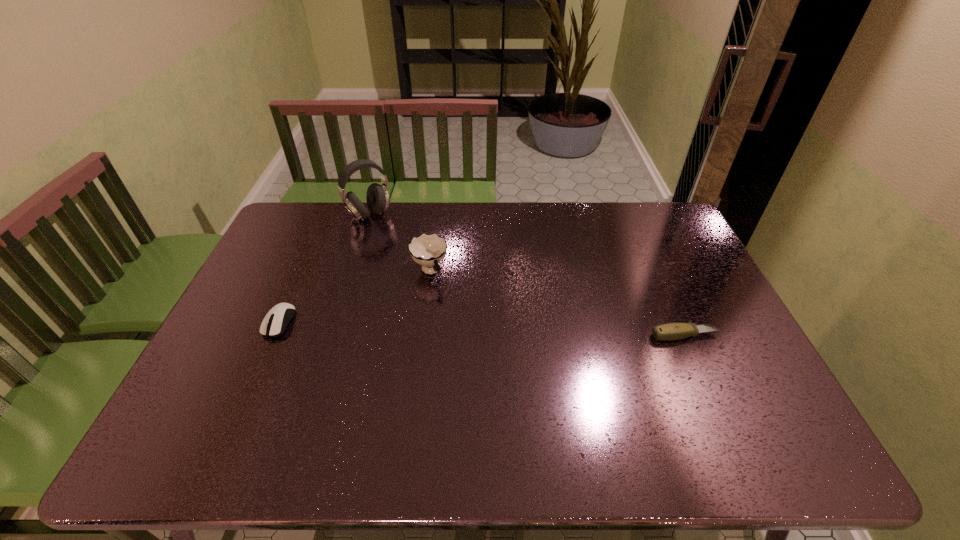
Find the location of `the second shortest object`. the second shortest object is located at coordinates (272, 325).

At what (x,y) coordinates should I click in order to perform the action: click on the leftmost object. Please return your answer as a coordinate pair (x, y). This screenshot has width=960, height=540. Looking at the image, I should click on (272, 325).

I want to click on the rightmost object, so click(x=671, y=331).

This screenshot has height=540, width=960. I want to click on the shortest object, so click(x=671, y=331).

Where is `the tallest object`? the tallest object is located at coordinates (377, 196).

Locate an element on the screen. The width and height of the screenshot is (960, 540). the third object from right to left is located at coordinates (377, 196).

At what (x,y) coordinates should I click in order to perform the action: click on the third shortest object. Please return your answer as a coordinate pair (x, y). Looking at the image, I should click on (426, 250).

Where is `the third object from left to right`? This screenshot has width=960, height=540. the third object from left to right is located at coordinates (426, 250).

The height and width of the screenshot is (540, 960). I want to click on vacant area located 0.110m on the front of the leftmost object, so [257, 373].

Identify the location of vacant space located 0.050m on the back of the rightmost object. (676, 314).